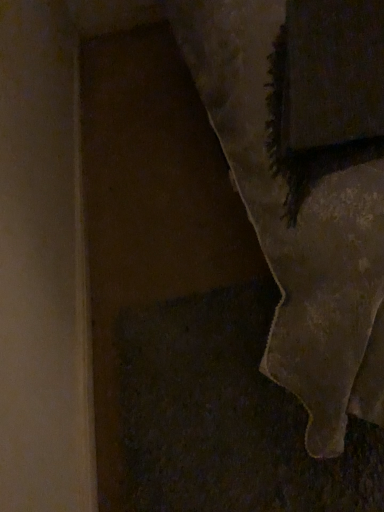
In order to face velvet beige curtain at upper right, should I rotate leftwards or rightwards?

Rotate right and turn 9.321 degrees.

Measure the distance between velvet beige curtain at upper right and camera.

The distance of velvet beige curtain at upper right from camera is 21.42 inches.

Image resolution: width=384 pixels, height=512 pixels. I want to click on velvet beige curtain at upper right, so click(297, 227).

Describe the element at coordinates (297, 227) in the screenshot. I see `velvet beige curtain at upper right` at that location.

Locate an element on the screen. The height and width of the screenshot is (512, 384). velvet beige curtain at upper right is located at coordinates (297, 227).